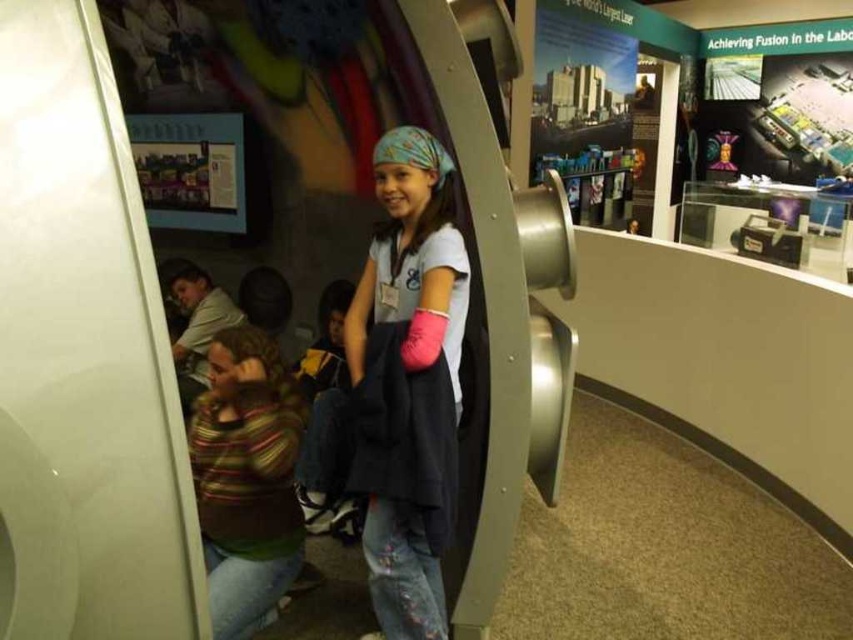
Is white matte shirt at center wider than striped sweater at lower left?

No, white matte shirt at center is not wider than striped sweater at lower left.

Which is in front, point (421, 632) or point (296, 502)?

Point (421, 632) is in front.

The image size is (853, 640). What do you see at coordinates (408, 381) in the screenshot?
I see `white matte shirt at center` at bounding box center [408, 381].

Where is `white matte shirt at center`? This screenshot has height=640, width=853. white matte shirt at center is located at coordinates (408, 381).